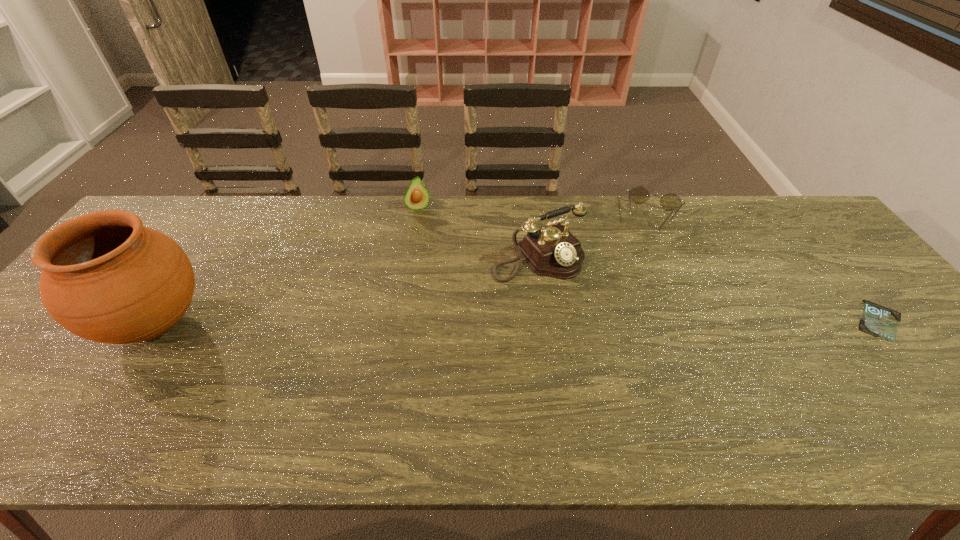
The width and height of the screenshot is (960, 540). Identify the location of pottery. (105, 277).

Find the location of `the tallest object`. the tallest object is located at coordinates (105, 277).

At what (x,y) coordinates should I click in order to perform the action: click on identity card. Please return your answer as a coordinate pair (x, y). Looking at the image, I should click on (879, 321).

Where is `the rightmost object`? Image resolution: width=960 pixels, height=540 pixels. the rightmost object is located at coordinates (879, 321).

This screenshot has width=960, height=540. I want to click on the third shortest object, so point(416,197).

Identify the location of the second object from left to right. (416, 197).

The width and height of the screenshot is (960, 540). In order to click on the third object from left to right in this screenshot , I will do `click(554, 251)`.

At what (x,y) coordinates should I click in order to perform the action: click on the fourth shortest object. Please return your answer as a coordinate pair (x, y). This screenshot has height=540, width=960. Looking at the image, I should click on (554, 251).

Locate an element on the screen. spectacles is located at coordinates (639, 194).

This screenshot has width=960, height=540. In order to click on the fourth object from left to right in this screenshot , I will do `click(639, 194)`.